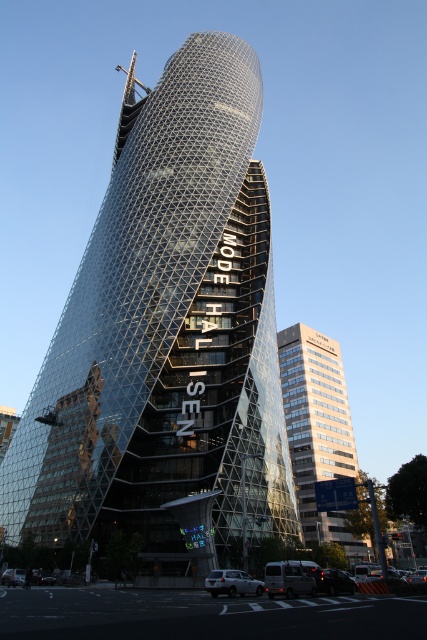
Locate an element on the screen. This screenshot has width=427, height=640. light beige glass building at center is located at coordinates (318, 429).

Between point (178, 188) and point (368, 588), which one is positioned in front?

Point (368, 588) is more forward.

Does transparent glass tower at center come in front of silver metallic van at lower center?

No, it is not.

Locate an element on the screen. The image size is (427, 640). transparent glass tower at center is located at coordinates (166, 340).

At what (x,y) coordinates should I click in order to perform the action: click on transparent glass tower at center. Please return your answer as a coordinate pair (x, y). Image resolution: width=427 pixels, height=640 pixels. Looking at the image, I should click on (166, 340).

Which of these two, transparent glass tower at center or light beige glass building at center, stands shorter?

Standing shorter between the two is light beige glass building at center.

Does transparent glass tower at center have a greater height compared to light beige glass building at center?

Yes, transparent glass tower at center is taller than light beige glass building at center.

Which is in front, point (111, 193) or point (338, 365)?

Point (111, 193) is in front.

Where is `transparent glass tower at center`? The width and height of the screenshot is (427, 640). transparent glass tower at center is located at coordinates (166, 340).